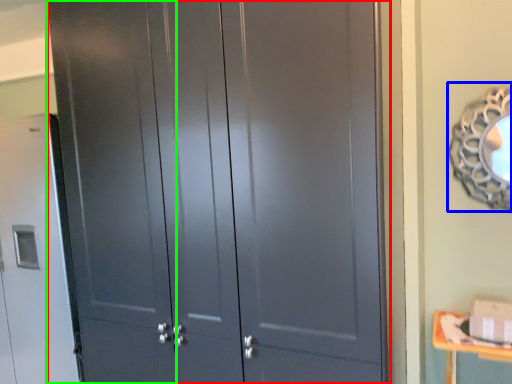
Question: Considering the real-world distances, which object is closest to door (highlighted by a red box)? mirror (highlighted by a blue box) or screen door (highlighted by a green box).

Choices:
 (A) mirror
 (B) screen door

Answer: (B)